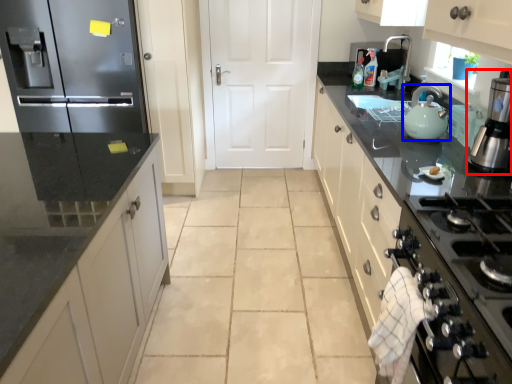
Question: Which object is further to the camera taking this photo, home appliance (highlighted by a red box) or kitchen appliance (highlighted by a blue box)?

Choices:
 (A) home appliance
 (B) kitchen appliance

Answer: (B)